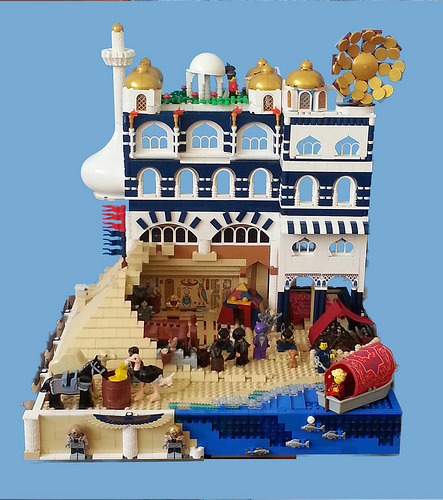
Identify the location of black toy horse. (84, 370), (57, 374), (59, 399), (88, 400).